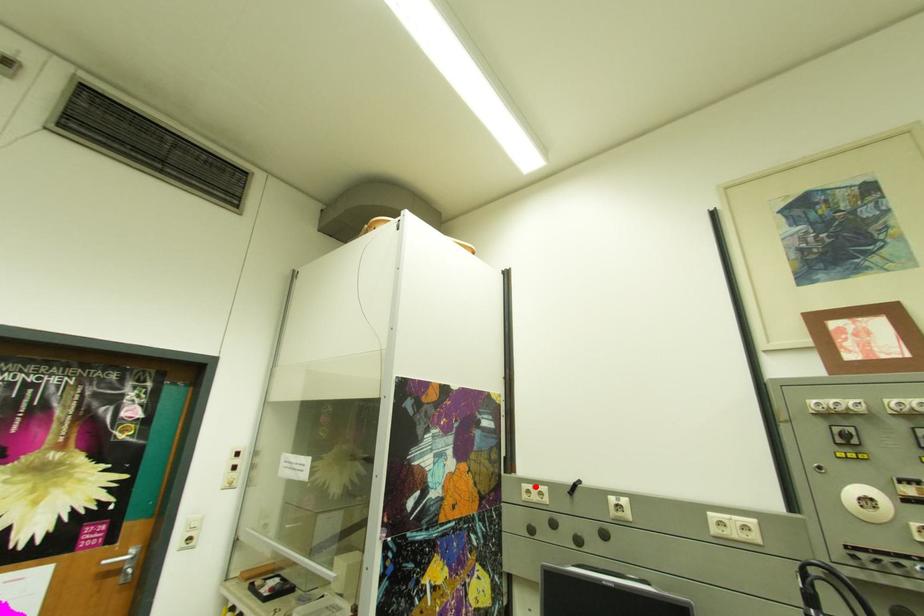
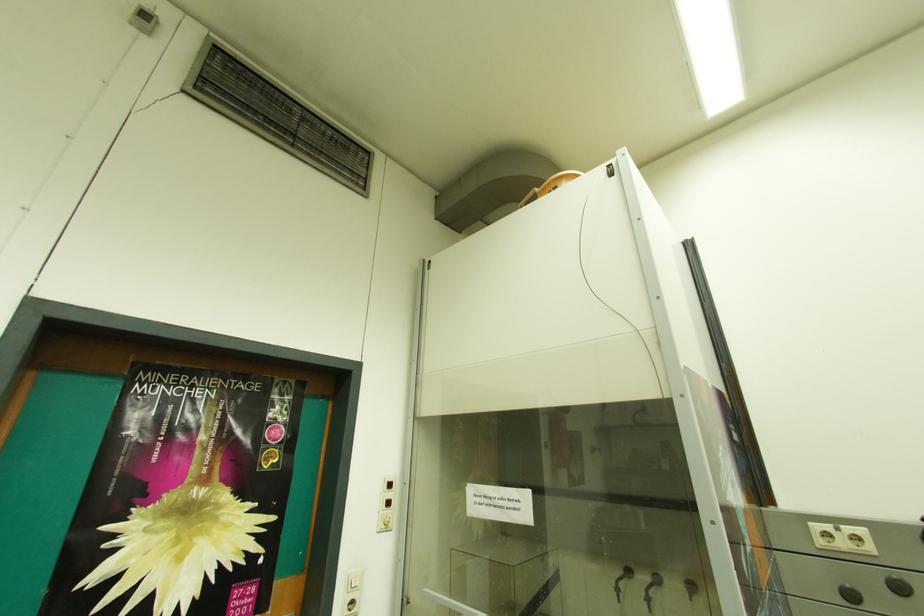
Where in the second image is the point corresponding to the highlighted location from the first image?

(827, 527)